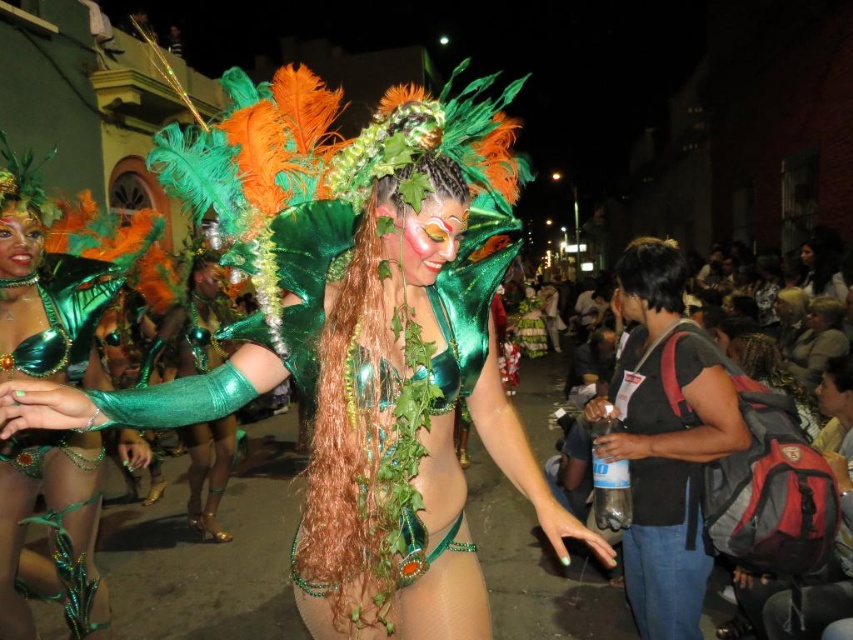
You are a photographer trying to capture the performer in the center of the image. You notice two points marked in the scene. The first point is at coordinate point[47,358] and the second is at point[634,486]. Which point should you focus on to ensure the performer is in the foreground of your photo?

You should focus on point[634,486] because it is in front of point[47,358], making the performer more prominent in the foreground.

You are a photographer at the carnival, and you want to take a photo of the green velvet bikini at center and the black matte backpack at right. Which object will appear larger in your photo?

The green velvet bikini at center will appear larger in the photo because it is closer to the viewer than the black matte backpack at right.